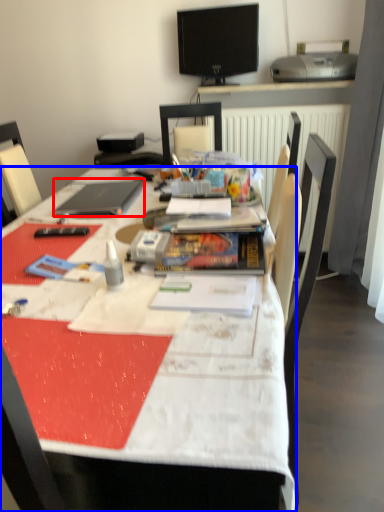
Question: Which object appears closest to the camera in this image, laptop (highlighted by a red box) or desk (highlighted by a blue box)?

Choices:
 (A) laptop
 (B) desk

Answer: (B)